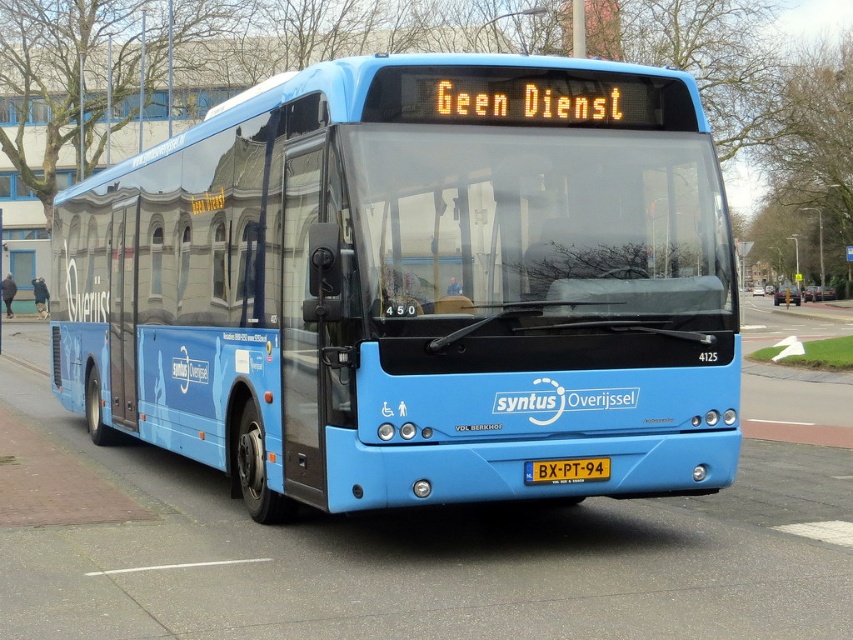
Who is higher up, matte blue bus at center or yellow metallic license plate at center?

matte blue bus at center is higher up.

Is matte blue bus at center below yellow metallic license plate at center?

Incorrect, matte blue bus at center is not positioned below yellow metallic license plate at center.

You are a GUI agent. You are given a task and a screenshot of the screen. Output one action in this format:
    pyautogui.click(x=<x>, y=<y>)
    Task: Click on the matte blue bus at center
    
    Given the screenshot: What is the action you would take?
    pyautogui.click(x=413, y=285)